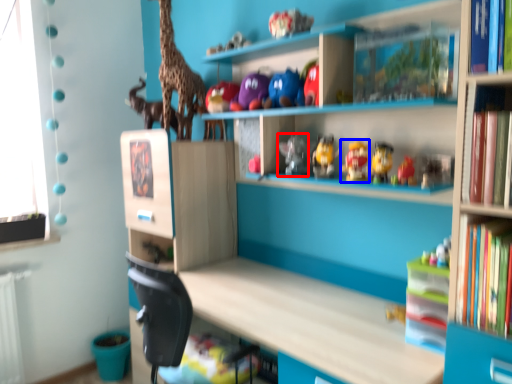
Question: Which of the following is the closest to the observer, toy (highlighted by a red box) or toy (highlighted by a blue box)?

Choices:
 (A) toy
 (B) toy

Answer: (B)